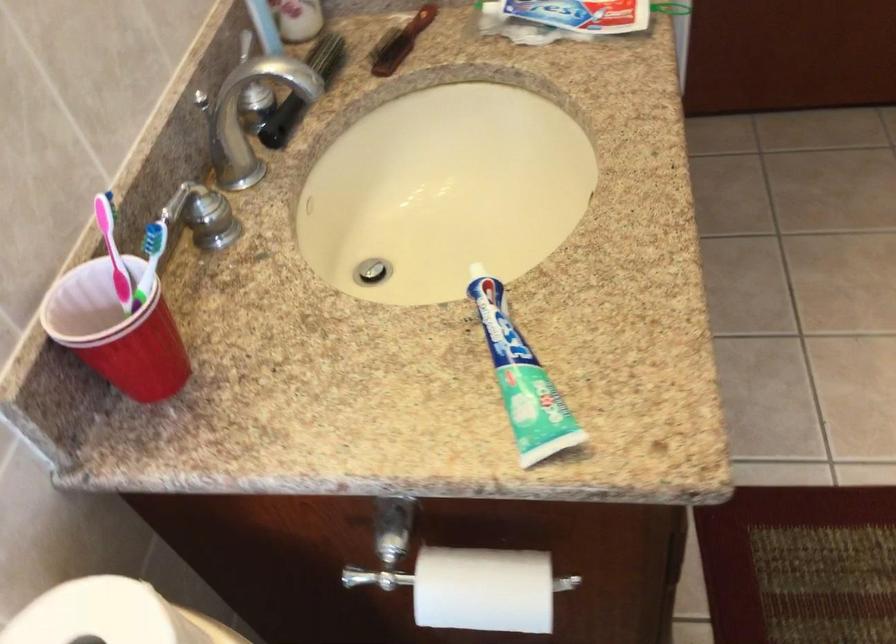
Identify the location of sink drain lever. The width and height of the screenshot is (896, 644). (372, 270).